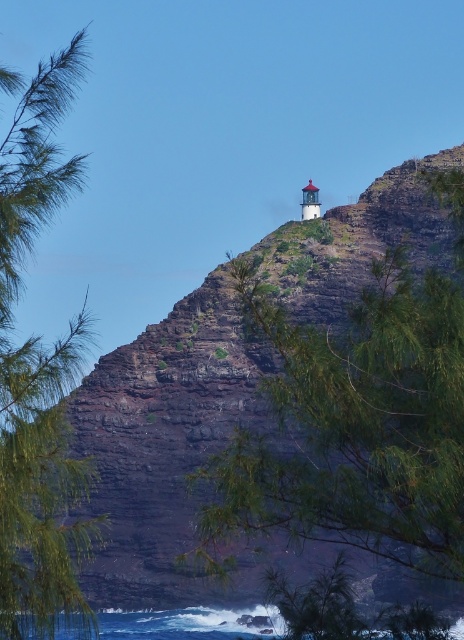
Can you confirm if green leafy tree at center is bigger than blue water at lower center?

Yes, green leafy tree at center is bigger than blue water at lower center.

Who is positioned more to the left, green leafy tree at center or blue water at lower center?

Positioned to the left is blue water at lower center.

Does point (350, 515) lie behind point (173, 627)?

That is False.

Identify the location of green leafy tree at center. [x=356, y=419].

Between green leafy tree at left and blue water at lower center, which one is positioned higher?

green leafy tree at left

Locate an element on the screen. green leafy tree at left is located at coordinates (38, 372).

Who is more distant from viewer, [414,452] or [8,157]?

The point [8,157] is more distant.

Does green leafy tree at center appear on the left side of green leafy tree at left?

In fact, green leafy tree at center is to the right of green leafy tree at left.

What are the coordinates of `green leafy tree at center` in the screenshot? It's located at (x=356, y=419).

At what (x,y) coordinates should I click in order to perform the action: click on green leafy tree at center. Please return your answer as a coordinate pair (x, y). Looking at the image, I should click on (356, 419).